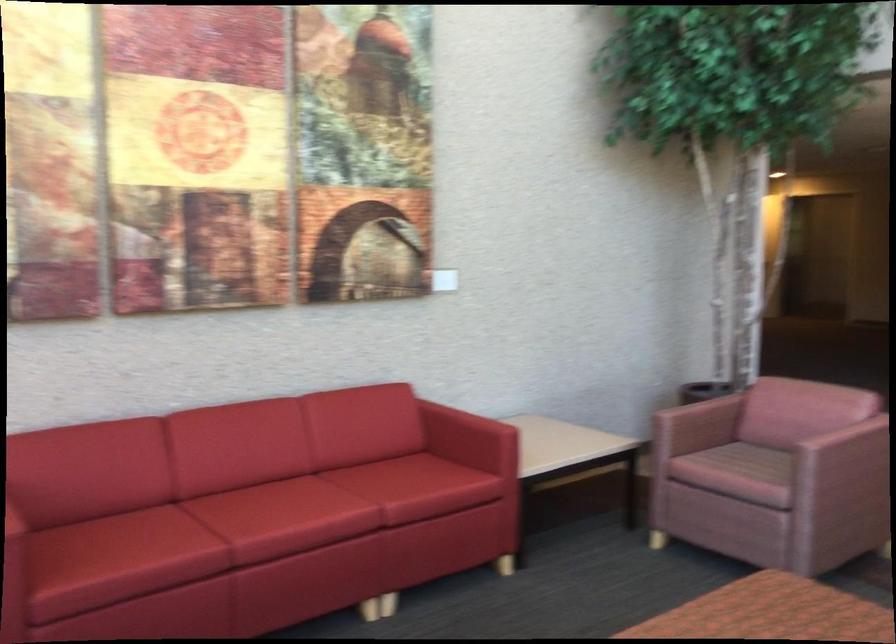
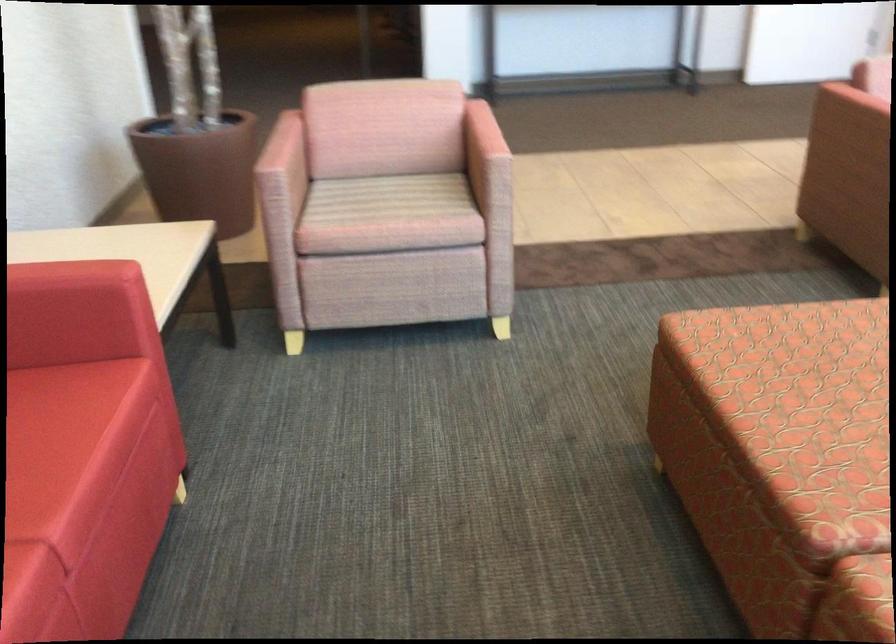
The point at (x=438, y=469) is marked in the first image. Where is the corresponding point in the second image?

(38, 408)